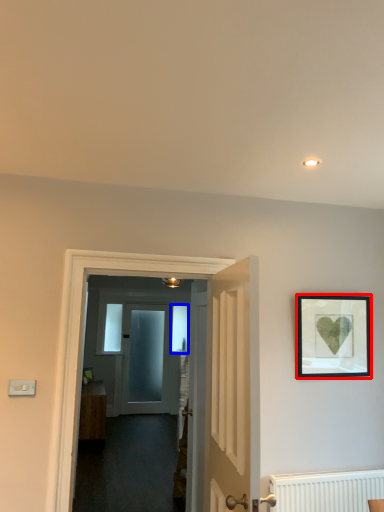
Question: Which object is closer to the camera taking this photo, picture frame (highlighted by a red box) or window (highlighted by a blue box)?

Choices:
 (A) picture frame
 (B) window

Answer: (A)